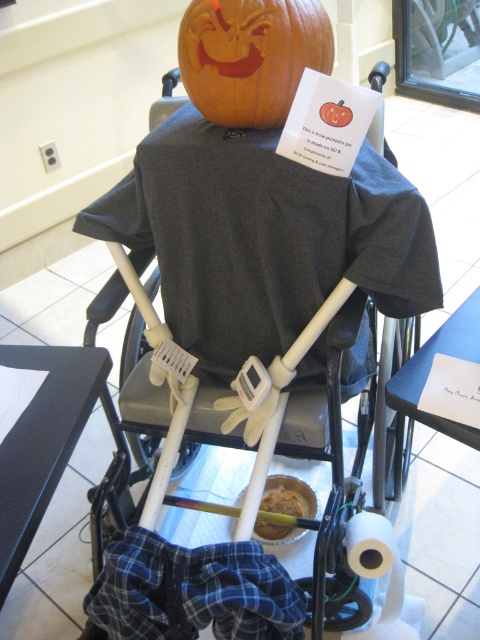
Who is positioned more to the right, white plastic baby carriage at center or white matte toilet paper at lower center?

Positioned to the right is white matte toilet paper at lower center.

Which is above, white plastic baby carriage at center or white matte toilet paper at lower center?

white plastic baby carriage at center is above.

Which is in front, point (330, 308) or point (374, 548)?

Positioned in front is point (330, 308).

Where is `white plastic baby carriage at center`? white plastic baby carriage at center is located at coordinates (273, 378).

Is blue flannel pants at lower center taller than white matte toilet paper at lower center?

No.

You are a GUI agent. You are given a task and a screenshot of the screen. Output one action in this format:
    pyautogui.click(x=<x>, y=<y>)
    Task: Click on the blue flannel pants at lower center
    
    Given the screenshot: What is the action you would take?
    pyautogui.click(x=192, y=592)

Find the location of a particular element. The image size is (480, 640). blue flannel pants at lower center is located at coordinates click(192, 592).

Is orange carved pumpkin at upper center thinner than golden brown bread at center?

In fact, orange carved pumpkin at upper center might be wider than golden brown bread at center.

Which is in front, point (251, 80) or point (282, 536)?

Point (251, 80) is in front.

This screenshot has height=640, width=480. What do you see at coordinates (251, 56) in the screenshot?
I see `orange carved pumpkin at upper center` at bounding box center [251, 56].

The image size is (480, 640). What are the coordinates of `orange carved pumpkin at upper center` in the screenshot? It's located at (251, 56).